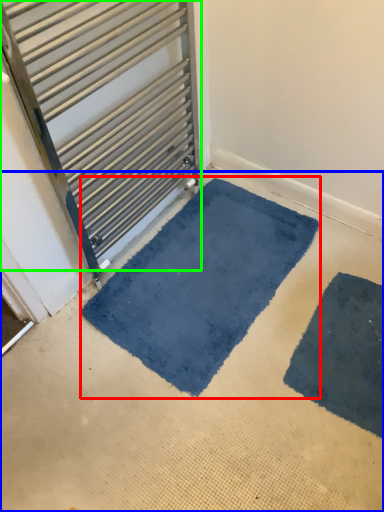
Question: Based on their relative distances, which object is farther from mat (highlighted by a red box)? Choose from concrete (highlighted by a blue box) and door (highlighted by a green box).

Choices:
 (A) concrete
 (B) door

Answer: (B)